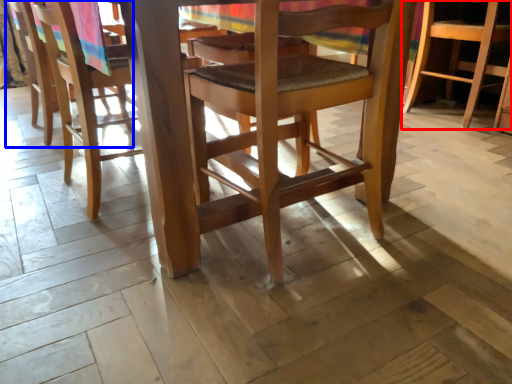
Question: Which of the following is the farthest to the observer, chair (highlighted by a red box) or chair (highlighted by a blue box)?

Choices:
 (A) chair
 (B) chair

Answer: (A)